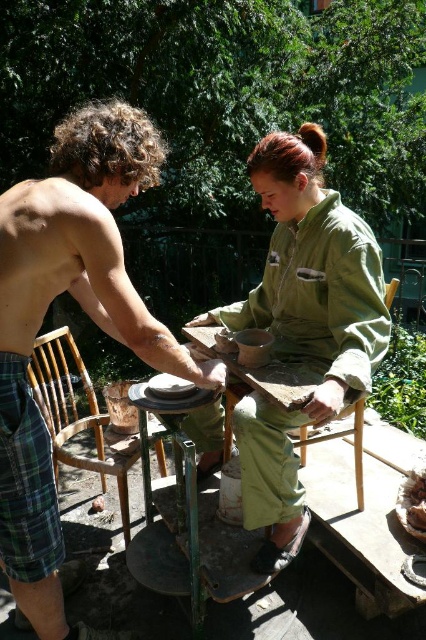
Question: Which of the following is the closest to the observer?

Choices:
 (A) (103, 429)
 (B) (2, 433)

Answer: (B)

Question: Which point is farther to the camera?

Choices:
 (A) brown crumbly bread at lower right
 (B) green matte jumpsuit at center
 (C) green plaid shorts at lower left

Answer: (A)

Question: Which object appears farthest from the camera in this image?

Choices:
 (A) green matte jumpsuit at center
 (B) wooden chair at center
 (C) wooden chair at left
 (D) green plaid shorts at lower left

Answer: (C)

Question: Is wooden chair at left positioned in front of brown crumbly bread at lower right?

Choices:
 (A) yes
 (B) no

Answer: (B)

Question: Does wooden chair at left have a lesser width compared to wooden chair at center?

Choices:
 (A) no
 (B) yes

Answer: (A)

Question: Is green matte jumpsuit at center thinner than wooden chair at center?

Choices:
 (A) yes
 (B) no

Answer: (B)